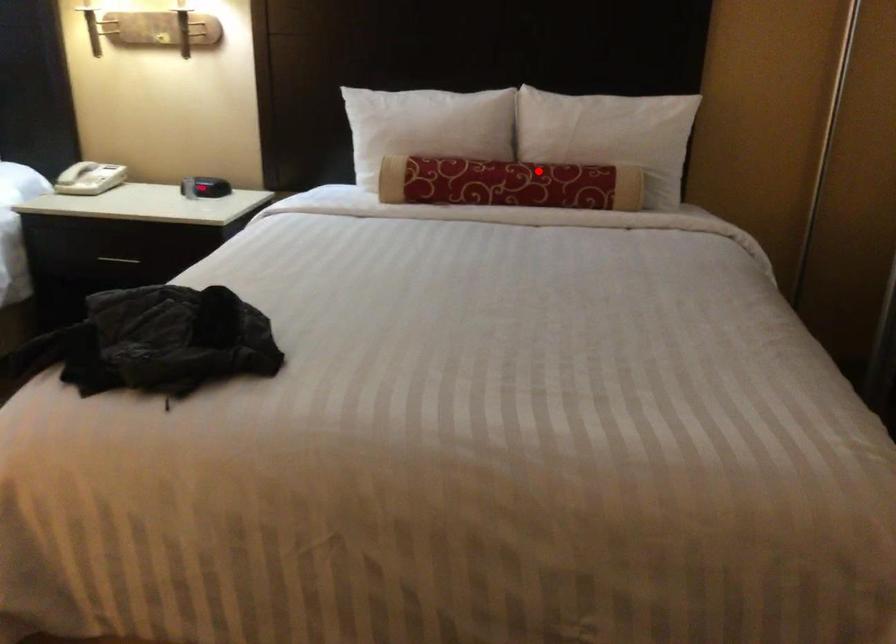
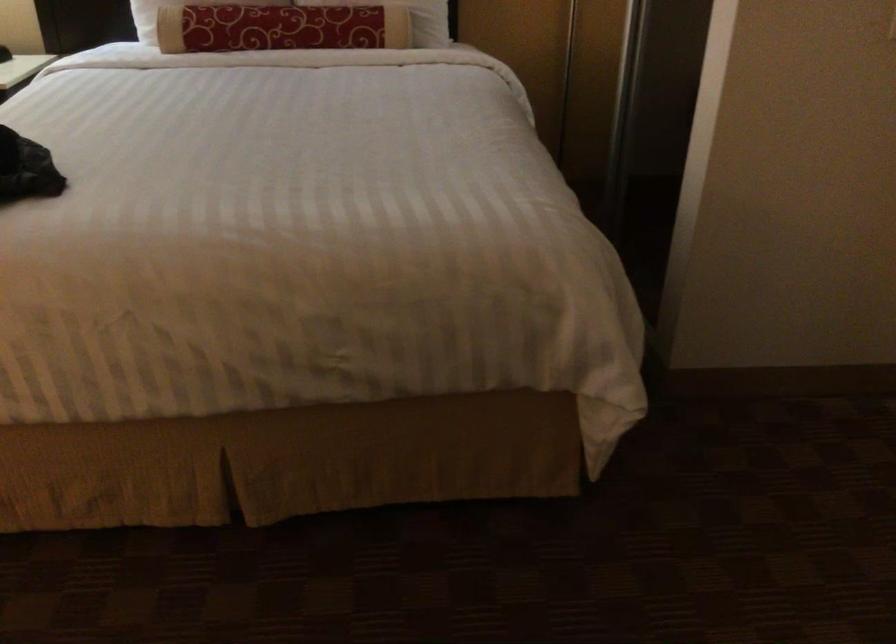
Locate, in the second image, the point that corresponds to the highlighted location in the first image.

(311, 15)